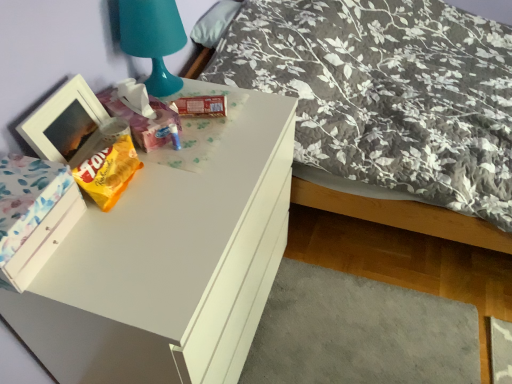
Where is `free spot to the right of matte brown package at upper center, the first package positioned from the right`? The width and height of the screenshot is (512, 384). free spot to the right of matte brown package at upper center, the first package positioned from the right is located at coordinates (251, 119).